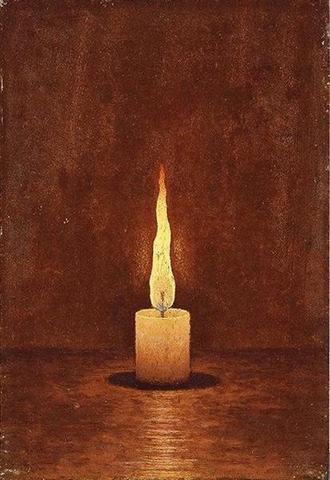
Locate an element on the screen. The height and width of the screenshot is (480, 330). background wall is located at coordinates (71, 347), (228, 350), (279, 347), (27, 347).